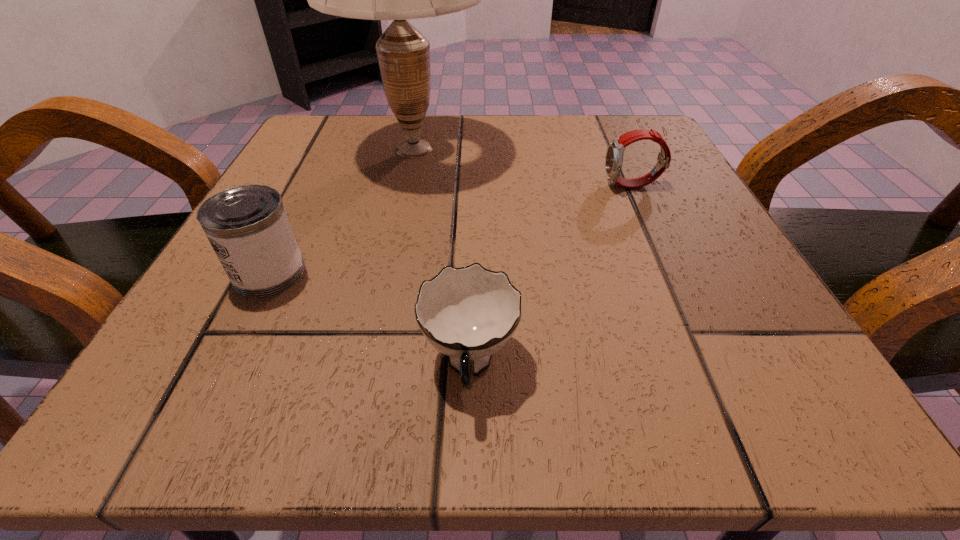
In order to click on lampshade in this screenshot , I will do `click(403, 53)`.

You are a GUI agent. You are given a task and a screenshot of the screen. Output one action in this format:
    pyautogui.click(x=<x>, y=<y>)
    Task: Click on the second nearest object
    
    Given the screenshot: What is the action you would take?
    pyautogui.click(x=247, y=226)

Locate an element on the screen. This screenshot has width=960, height=540. the rightmost object is located at coordinates (614, 156).

You are a GUI agent. You are given a task and a screenshot of the screen. Output one action in this format:
    pyautogui.click(x=<x>, y=<y>)
    Task: Click on the cup
    This screenshot has height=540, width=960.
    Given the screenshot: What is the action you would take?
    pyautogui.click(x=468, y=314)

Locate an element on the screen. This screenshot has height=540, width=960. vacant region located on the front of the lampshade is located at coordinates (376, 321).

Locate an element on the screen. vacant area situated on the right of the can is located at coordinates (398, 273).

Identify the location of vacant region located 0.210m on the face of the rightmost object. (483, 186).

Where is `vacant space situated 0.150m on the face of the rightmost object`? The height and width of the screenshot is (540, 960). vacant space situated 0.150m on the face of the rightmost object is located at coordinates (517, 186).

Where is `free space located on the face of the rightmost object`? The width and height of the screenshot is (960, 540). free space located on the face of the rightmost object is located at coordinates (540, 186).

The width and height of the screenshot is (960, 540). Identify the location of object located at the far edge. (403, 53).